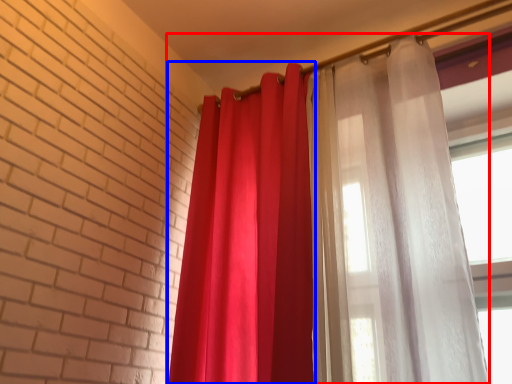
Question: Which object appears farthest to the camera in this image, curtain (highlighted by a red box) or curtain (highlighted by a blue box)?

Choices:
 (A) curtain
 (B) curtain

Answer: (B)